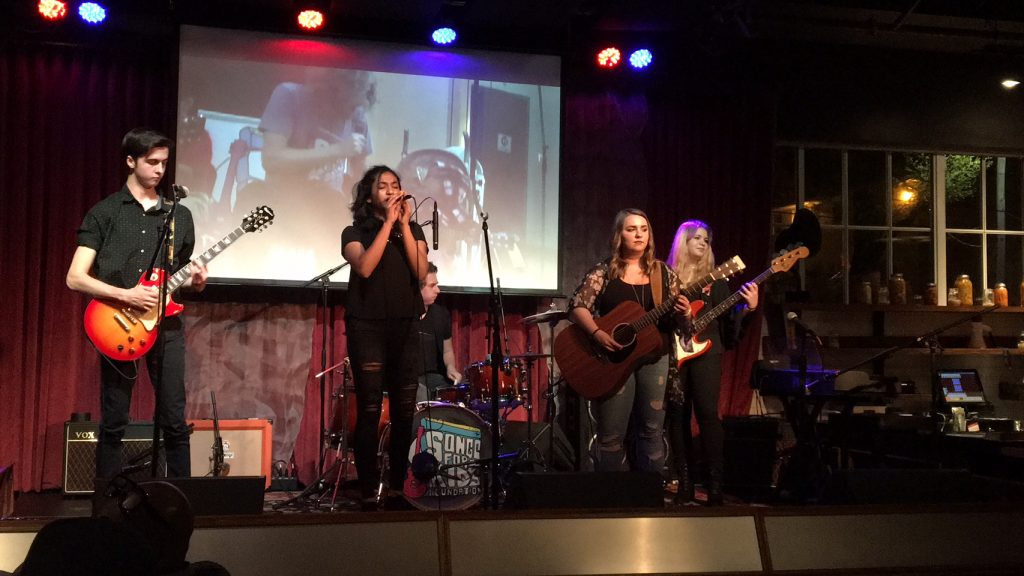
What are the coordinates of `spotlights` in the screenshot? It's located at (50, 16), (88, 21), (318, 25), (444, 44), (598, 59), (643, 67).